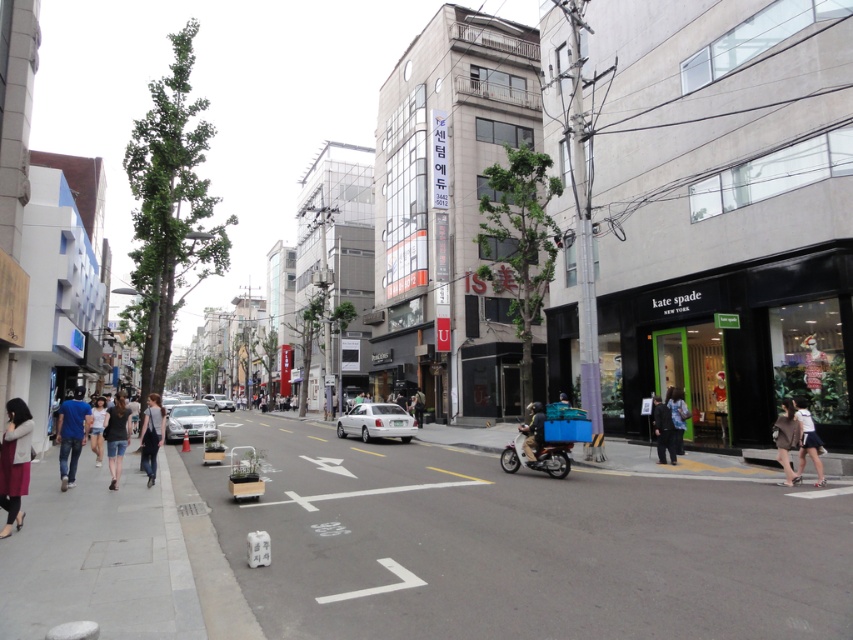
Between point (77, 420) and point (218, 403), which one is positioned in front?

Positioned in front is point (77, 420).

Who is more distant from viewer, (x=67, y=477) or (x=219, y=401)?

The point (x=219, y=401) is more distant.

Is point (56, 440) in front of point (215, 410)?

Yes, it is in front of point (215, 410).

The image size is (853, 640). Find the location of `blue jeans at left`. blue jeans at left is located at coordinates (71, 435).

Can you confirm if gray concrete sidewalk at lower left is positioned above dark gray helmet at center?

Incorrect, gray concrete sidewalk at lower left is not positioned above dark gray helmet at center.

Looking at this image, is the position of gray concrete sidewalk at lower left less distant than that of dark gray helmet at center?

Yes, it is.

The width and height of the screenshot is (853, 640). What do you see at coordinates (97, 557) in the screenshot? I see `gray concrete sidewalk at lower left` at bounding box center [97, 557].

Identify the location of gray concrete sidewalk at lower left. (97, 557).

Is matte gray coat at lower left closer to camera compared to dark gray jacket at lower right?

Yes, it is in front of dark gray jacket at lower right.

What do you see at coordinates (15, 461) in the screenshot?
I see `matte gray coat at lower left` at bounding box center [15, 461].

Who is more forward, (25, 448) or (664, 449)?

Point (25, 448) is in front.

You are a GUI agent. You are given a task and a screenshot of the screen. Output one action in this format:
    pyautogui.click(x=<x>, y=<y>)
    Task: Click on the matte gray coat at lower left
    The height and width of the screenshot is (640, 853).
    Given the screenshot: What is the action you would take?
    pyautogui.click(x=15, y=461)